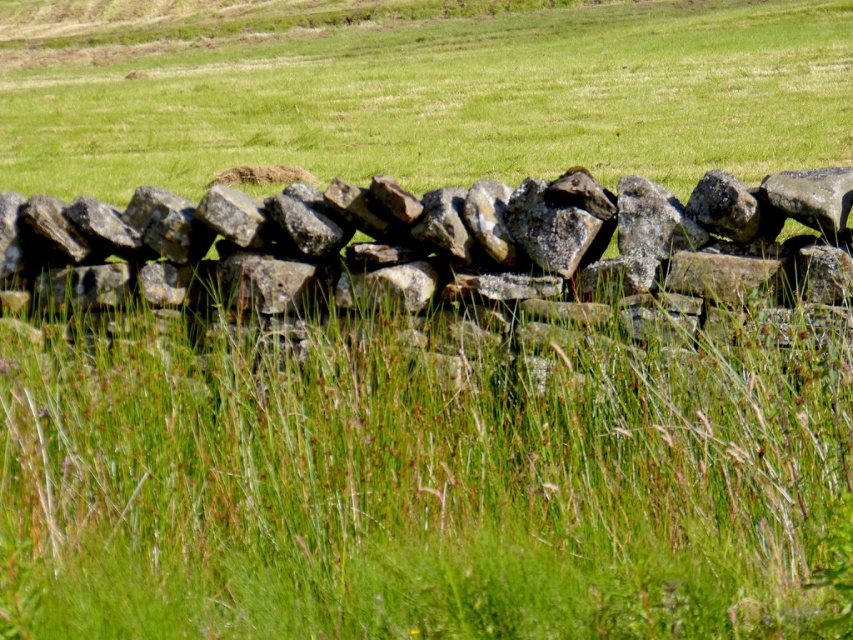
Can you confirm if green grass at center is shorter than rough stone wall at center?

No, green grass at center is not shorter than rough stone wall at center.

Does green grass at center appear over rough stone wall at center?

Yes, green grass at center is above rough stone wall at center.

Is point (144, 157) closer to viewer compared to point (422, 204)?

No.

You are a GUI agent. You are given a task and a screenshot of the screen. Output one action in this format:
    pyautogui.click(x=<x>, y=<y>)
    Task: Click on the green grass at center
    This screenshot has height=640, width=853.
    Given the screenshot: What is the action you would take?
    pyautogui.click(x=416, y=90)